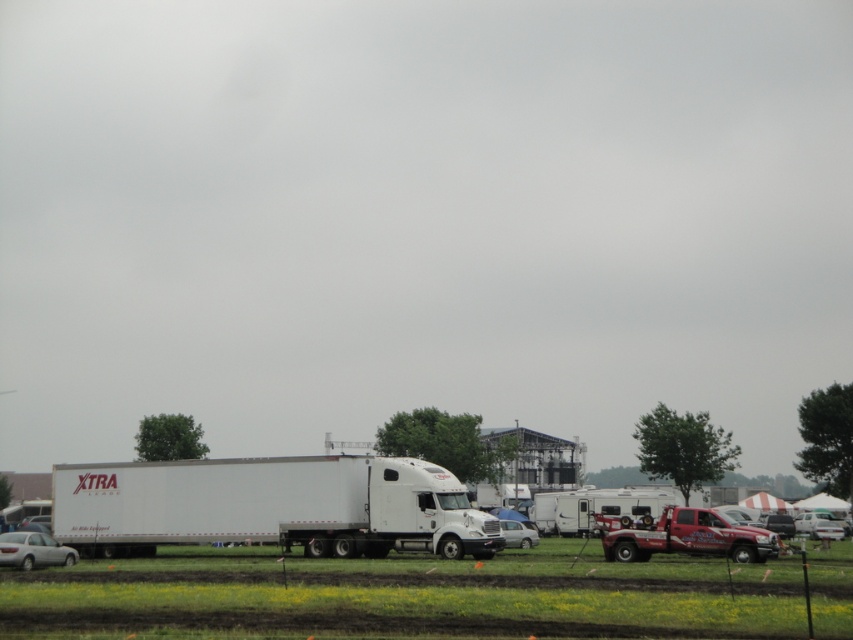
Question: Is white glossy car at lower right below white glossy car at center?

Choices:
 (A) yes
 (B) no

Answer: (A)

Question: Observing the image, what is the correct spatial positioning of white glossy car at lower right in reference to white glossy car at center?

Choices:
 (A) right
 (B) left

Answer: (A)

Question: Which point is closer to the camera?

Choices:
 (A) white glossy car at center
 (B) white glossy camper at center
 (C) white glossy car at lower right
 (D) white matte trailer truck at center

Answer: (D)

Question: Among these objects, which one is nearest to the camera?

Choices:
 (A) white glossy camper at center
 (B) white matte trailer truck at center
 (C) green grass at lower center

Answer: (C)

Question: From the image, what is the correct spatial relationship of green grass at lower center in relation to white matte sedan at lower left?

Choices:
 (A) above
 (B) below

Answer: (A)

Question: Which of these objects is positioned farthest from the red matte truck at lower right?

Choices:
 (A) white glossy car at center
 (B) white glossy car at lower right

Answer: (B)